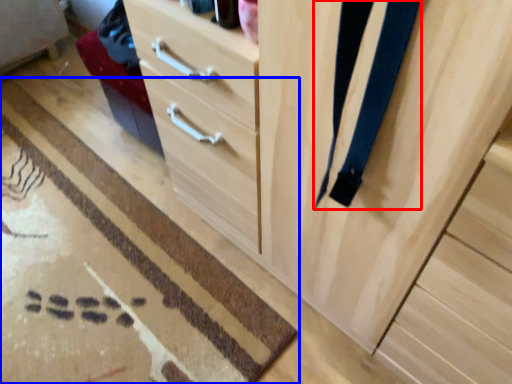
Question: Which object is further to the camera taking this photo, suspenders (highlighted by a red box) or doormat (highlighted by a blue box)?

Choices:
 (A) suspenders
 (B) doormat

Answer: (B)